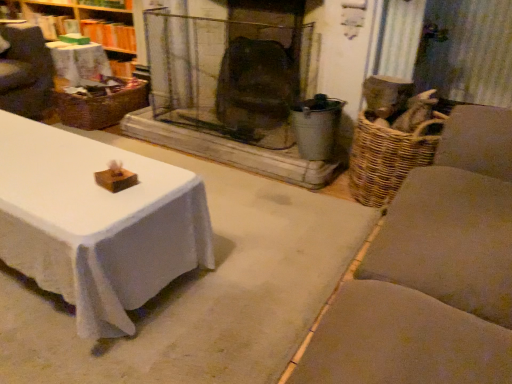
Question: Is wooden wicker basket at upper left positioned in front of woven brown basket at left?

Choices:
 (A) no
 (B) yes

Answer: (A)

Question: Is wooden wicker basket at upper left wider than woven brown basket at left?

Choices:
 (A) no
 (B) yes

Answer: (A)

Question: Is wooden wicker basket at upper left aimed at woven brown basket at left?

Choices:
 (A) yes
 (B) no

Answer: (A)

Question: From a real-world perspective, is wooden wicker basket at upper left positioned over woven brown basket at left based on gravity?

Choices:
 (A) yes
 (B) no

Answer: (A)

Question: Is wooden wicker basket at upper left facing away from woven brown basket at left?

Choices:
 (A) no
 (B) yes

Answer: (A)

Question: Does wooden wicker basket at upper left appear on the right side of woven brown basket at left?

Choices:
 (A) yes
 (B) no

Answer: (B)

Question: Is woven brown basket at left positioned in front of wooden wicker basket at upper left?

Choices:
 (A) yes
 (B) no

Answer: (A)

Question: Can you confirm if woven brown basket at left is positioned to the left of wooden wicker basket at upper left?

Choices:
 (A) yes
 (B) no

Answer: (B)

Question: Can you confirm if woven brown basket at left is wider than wooden wicker basket at upper left?

Choices:
 (A) no
 (B) yes

Answer: (B)

Question: Is woven brown basket at left further to camera compared to wooden wicker basket at upper left?

Choices:
 (A) yes
 (B) no

Answer: (B)

Question: Is woven brown basket at left taller than wooden wicker basket at upper left?

Choices:
 (A) yes
 (B) no

Answer: (B)

Question: Is woven brown basket at left touching wooden wicker basket at upper left?

Choices:
 (A) no
 (B) yes

Answer: (A)

Question: In terms of width, does wooden wicker basket at upper left look wider or thinner when compared to woven brown basket at left?

Choices:
 (A) wide
 (B) thin

Answer: (B)